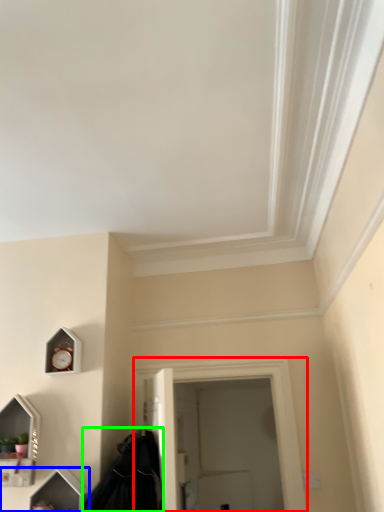
Question: Which object is positioned closest to window (highlighted by a red box)? Select from vanity (highlighted by a blue box) and cloak (highlighted by a green box).

Choices:
 (A) vanity
 (B) cloak

Answer: (B)